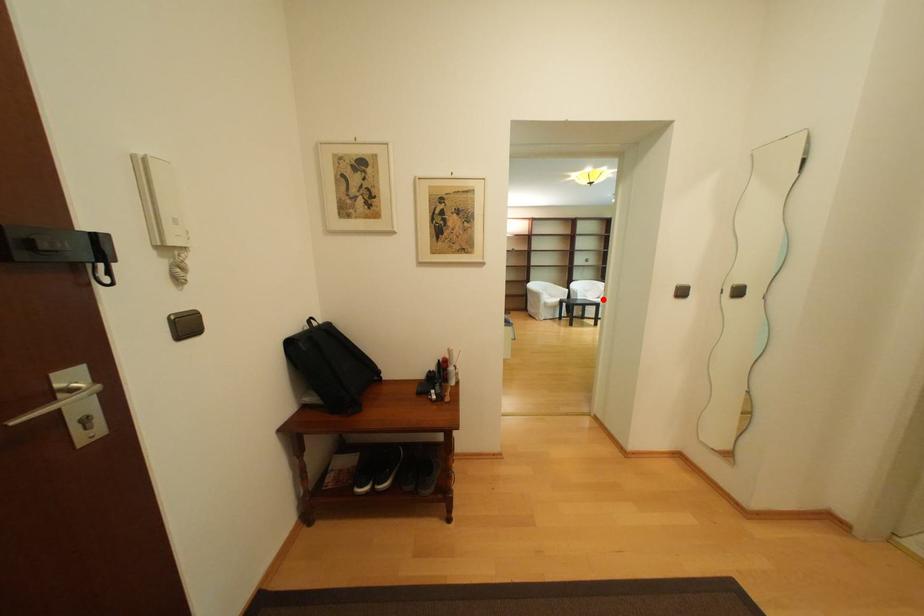
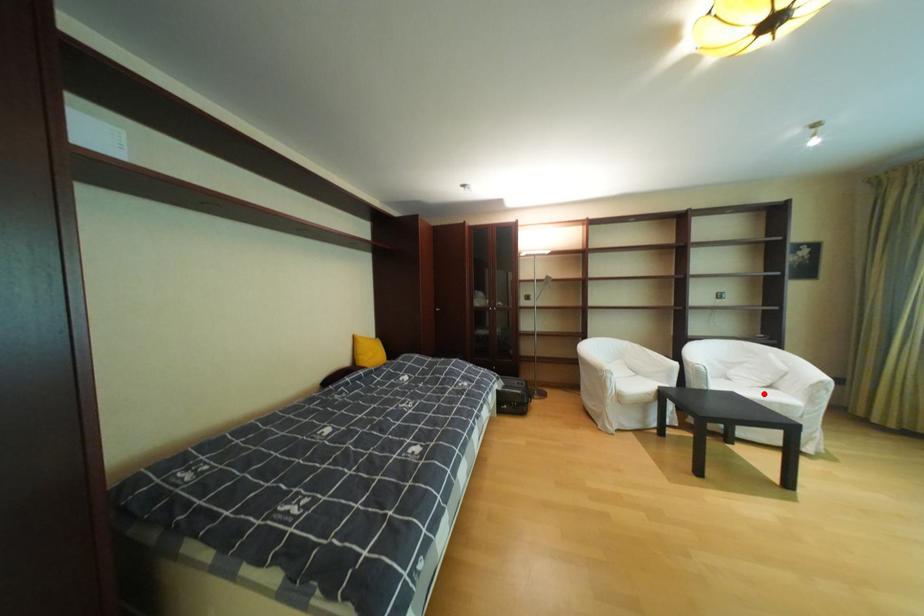
I am providing you with two images of the same scene from different viewpoints. A red point is marked on the first image and another point is marked on the second image. Do the highlighted points in image1 and image2 indicate the same real-world spot?

Yes